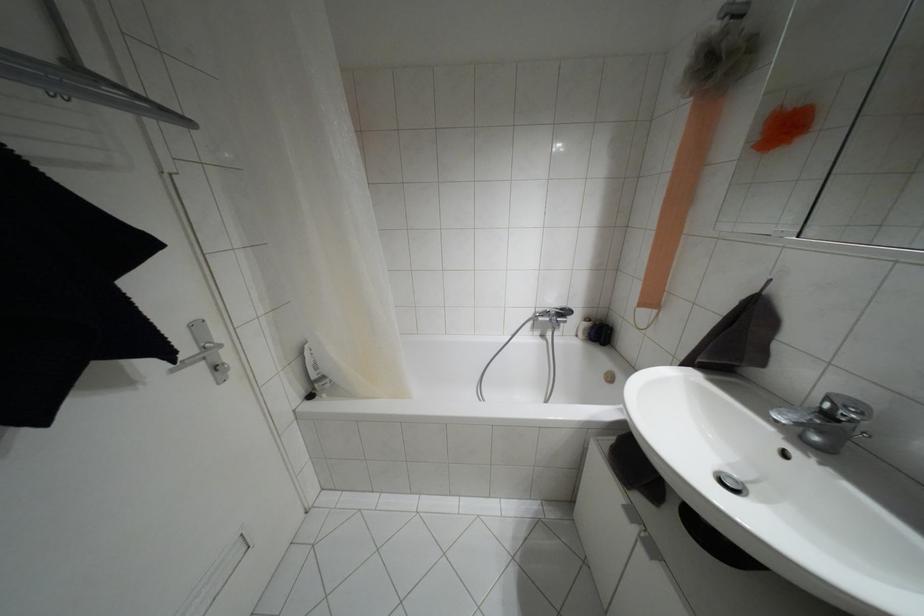
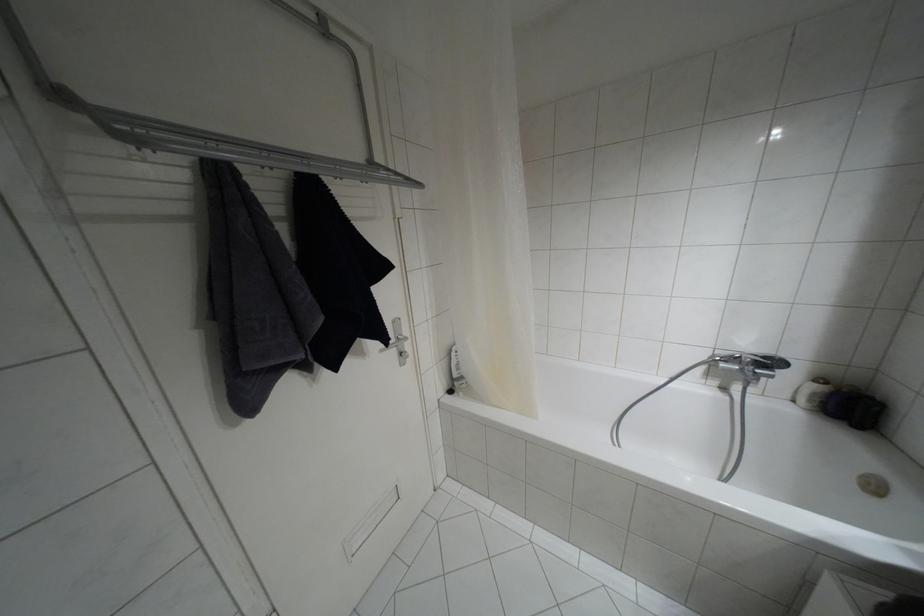
In the second image, find the point that corresponds to (x=561, y=309) in the first image.

(763, 357)